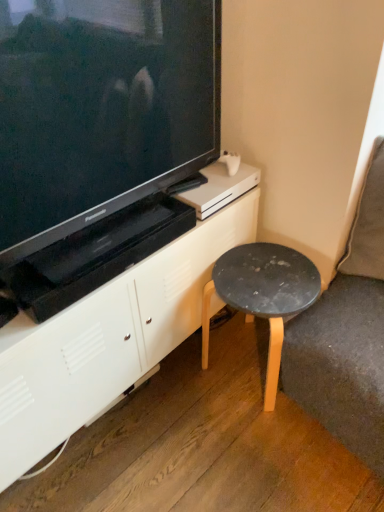
What do you see at coordinates (262, 295) in the screenshot? I see `black matte stool at lower right` at bounding box center [262, 295].

Measure the distance between point (232, 226) and camera.

Point (232, 226) and camera are 1.44 meters apart from each other.

The width and height of the screenshot is (384, 512). What are the coordinates of `matte black television at upper left` in the screenshot? It's located at (100, 109).

In order to face matte black television at upper left, should I rotate leftwards or rightwards?

You should look left and rotate roughly 10.188 degrees.

Image resolution: width=384 pixels, height=512 pixels. I want to click on black matte stool at lower right, so click(x=262, y=295).

Can you confirm if white matte cabinet at center is wider than black matte stool at lower right?

Indeed, white matte cabinet at center has a greater width compared to black matte stool at lower right.

Where is `cabinetry on the left of black matte stool at lower right`? cabinetry on the left of black matte stool at lower right is located at coordinates (106, 340).

Which is in front, point (119, 362) or point (245, 288)?

The point (119, 362) is more forward.

Is the depth of white matte cabinet at center less than that of black matte stool at lower right?

Yes, the depth of white matte cabinet at center is less than that of black matte stool at lower right.

Considering the relative sizes of white matte cabinet at center and matte black television at upper left in the image provided, is white matte cabinet at center thinner than matte black television at upper left?

In fact, white matte cabinet at center might be wider than matte black television at upper left.

Considering the positions of points (33, 435) and (164, 63), is point (33, 435) closer to camera compared to point (164, 63)?

Yes, point (33, 435) is closer to viewer.

Considering the relative positions of white matte cabinet at center and matte black television at upper left in the image provided, is white matte cabinet at center in front of matte black television at upper left?

→ No.

Is white matte cabinet at center smaller than matte black television at upper left?

No, white matte cabinet at center is not smaller than matte black television at upper left.

Is black matte stool at lower right in contact with matte black television at upper left?

No, black matte stool at lower right is not touching matte black television at upper left.

Who is bigger, black matte stool at lower right or matte black television at upper left?

matte black television at upper left is bigger.

From the image's perspective, would you say black matte stool at lower right is shown under matte black television at upper left?

Correct, black matte stool at lower right appears lower than matte black television at upper left in the image.

Based on the photo, which is more to the left, black matte stool at lower right or matte black television at upper left?

From the viewer's perspective, matte black television at upper left appears more on the left side.

Which is less distant, (144, 186) or (275, 295)?

Clearly, point (144, 186) is closer to the camera than point (275, 295).

Is matte black television at upper left positioned in front of black matte stool at lower right?

Yes, matte black television at upper left is closer to the camera.

Is black matte stool at lower right located within matte black television at upper left?

No, black matte stool at lower right is located outside of matte black television at upper left.

Would you say matte black television at upper left is to the left or to the right of black matte stool at lower right in the picture?

matte black television at upper left is to the left of black matte stool at lower right.

From a real-world perspective, which is physically above, black matte stool at lower right or white matte cabinet at center?

white matte cabinet at center is physically above.

Is black matte stool at lower right facing towards white matte cabinet at center?

No, black matte stool at lower right is not facing towards white matte cabinet at center.

From the image's perspective, between black matte stool at lower right and white matte cabinet at center, which one is located above?

white matte cabinet at center is shown above in the image.

Is black matte stool at lower right to the left or to the right of white matte cabinet at center in the image?

black matte stool at lower right is positioned on white matte cabinet at center's right side.

Based on the photo, which point is more distant from viewer, (126, 44) or (118, 326)?

The point (118, 326) is farther.

Can you confirm if matte black television at upper left is thinner than white matte cabinet at center?

Indeed, matte black television at upper left has a lesser width compared to white matte cabinet at center.

Considering the positions of objects matte black television at upper left and white matte cabinet at center in the image provided, who is in front, matte black television at upper left or white matte cabinet at center?

matte black television at upper left is more forward.

At what (x,y) coordinates should I click in order to perform the action: click on cabinetry in front of the black matte stool at lower right. Please return your answer as a coordinate pair (x, y). Looking at the image, I should click on (106, 340).

The width and height of the screenshot is (384, 512). In order to click on television on the right of white matte cabinet at center in this screenshot , I will do `click(100, 109)`.

From the image, which object appears to be farther from matte black television at upper left, black matte stool at lower right or white matte cabinet at center?

black matte stool at lower right.

When comparing their distances from black matte stool at lower right, does white matte cabinet at center or matte black television at upper left seem closer?

white matte cabinet at center is closer to black matte stool at lower right.

From the image, which object appears to be farther from matte black television at upper left, white matte cabinet at center or black matte stool at lower right?

Among the two, black matte stool at lower right is located further to matte black television at upper left.

When comparing their distances from white matte cabinet at center, does black matte stool at lower right or matte black television at upper left seem further?

matte black television at upper left is positioned further to the anchor white matte cabinet at center.

Which object lies nearer to the anchor point black matte stool at lower right, matte black television at upper left or white matte cabinet at center?

white matte cabinet at center.

Estimate the real-world distances between objects in this image. Which object is further from white matte cabinet at center, matte black television at upper left or black matte stool at lower right?

matte black television at upper left is positioned further to the anchor white matte cabinet at center.

Locate an element on the screen. This screenshot has width=384, height=512. cabinetry between matte black television at upper left and black matte stool at lower right vertically is located at coordinates (106, 340).